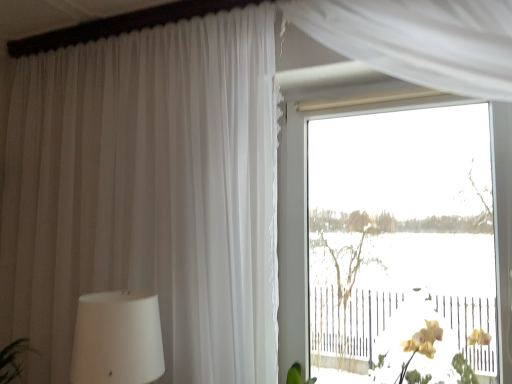
Question: Does transparent glass window at center have a greater height compared to metallic silver rail at lower right?

Choices:
 (A) yes
 (B) no

Answer: (A)

Question: Is transparent glass window at center shorter than metallic silver rail at lower right?

Choices:
 (A) no
 (B) yes

Answer: (A)

Question: Is transparent glass window at center outside of metallic silver rail at lower right?

Choices:
 (A) yes
 (B) no

Answer: (A)

Question: Is metallic silver rail at lower right completely or partially inside transparent glass window at center?

Choices:
 (A) yes
 (B) no

Answer: (B)

Question: Can you confirm if transparent glass window at center is bigger than metallic silver rail at lower right?

Choices:
 (A) no
 (B) yes

Answer: (B)

Question: Can you confirm if transparent glass window at center is smaller than metallic silver rail at lower right?

Choices:
 (A) no
 (B) yes

Answer: (A)

Question: Is metallic silver rail at lower right wider than transparent glass window at center?

Choices:
 (A) yes
 (B) no

Answer: (A)

Question: Is metallic silver rail at lower right closer to the viewer compared to transparent glass window at center?

Choices:
 (A) yes
 (B) no

Answer: (A)

Question: Is transparent glass window at center located within metallic silver rail at lower right?

Choices:
 (A) no
 (B) yes

Answer: (A)

Question: Is the depth of metallic silver rail at lower right greater than that of transparent glass window at center?

Choices:
 (A) yes
 (B) no

Answer: (B)

Question: Is metallic silver rail at lower right facing away from transparent glass window at center?

Choices:
 (A) no
 (B) yes

Answer: (B)

Question: Would you say metallic silver rail at lower right is outside transparent glass window at center?

Choices:
 (A) yes
 (B) no

Answer: (A)

Question: Is metallic silver rail at lower right wider or thinner than transparent glass window at center?

Choices:
 (A) thin
 (B) wide

Answer: (B)